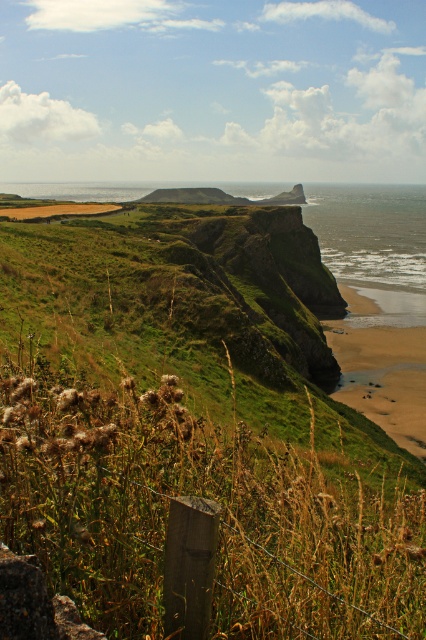
You are standing at the cliff edge and want to place a small flag exactly 2.5 meters away from where you are standing. Is the point marked as point (54, 579) in the image within the required distance?

The point marked as point (54, 579) is 2.64 meters from the viewer, which is slightly beyond the 2.5 meters required. Therefore, it is not within the desired distance.